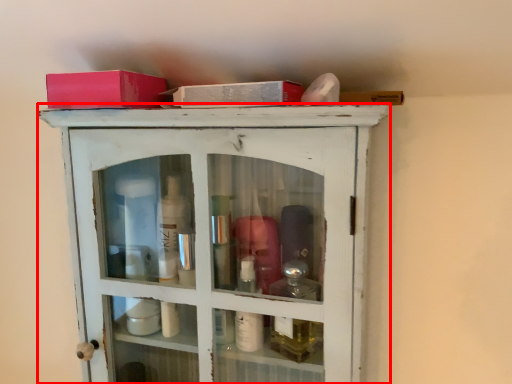
Question: Observing the image, what is the correct spatial positioning of cupboard (annotated by the red box) in reference to box?

Choices:
 (A) left
 (B) right

Answer: (B)